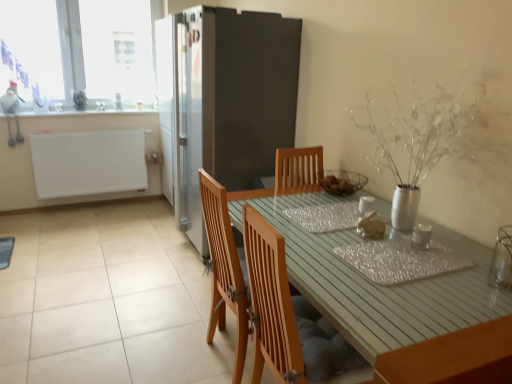
The height and width of the screenshot is (384, 512). In order to click on blank space situated above wooden table at center (from a real-world perspective) in this screenshot , I will do `click(342, 224)`.